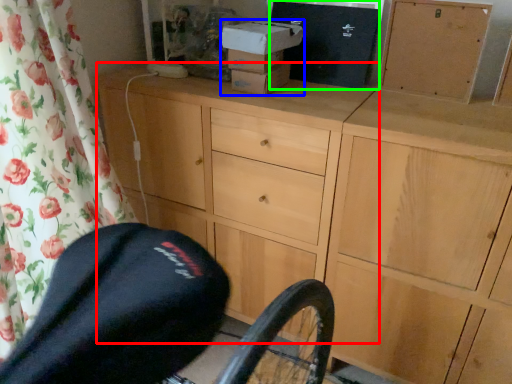
Question: Considering the real-world distances, which object is closest to chest of drawers (highlighted by a red box)? box (highlighted by a blue box) or box (highlighted by a green box).

Choices:
 (A) box
 (B) box

Answer: (A)